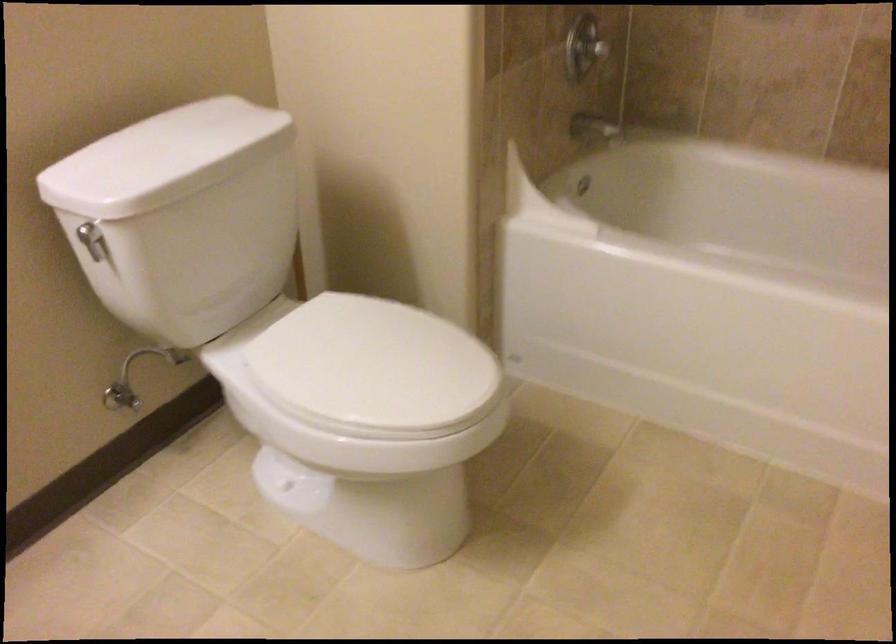
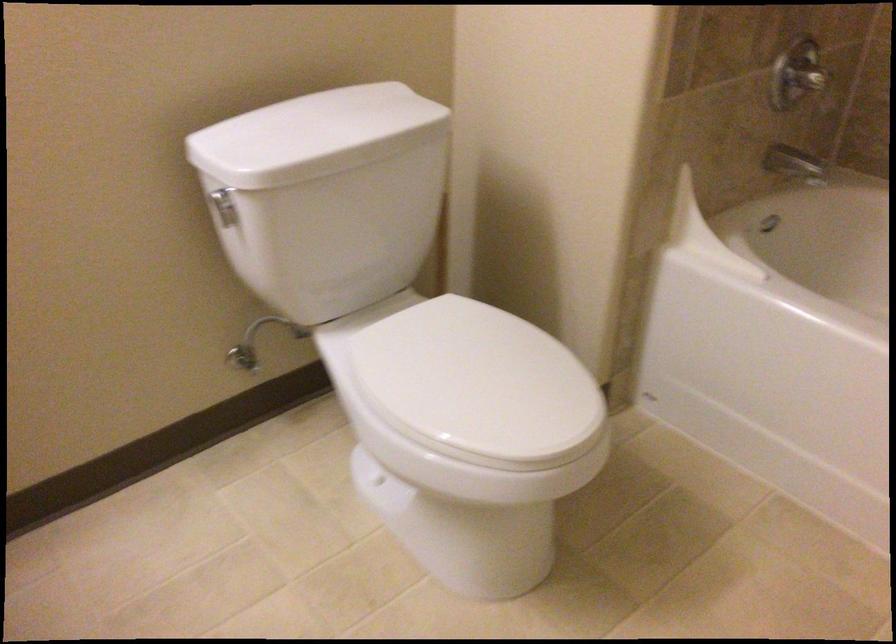
Find the pixel in the second image that matches pixel 90 243 in the first image.

(224, 205)